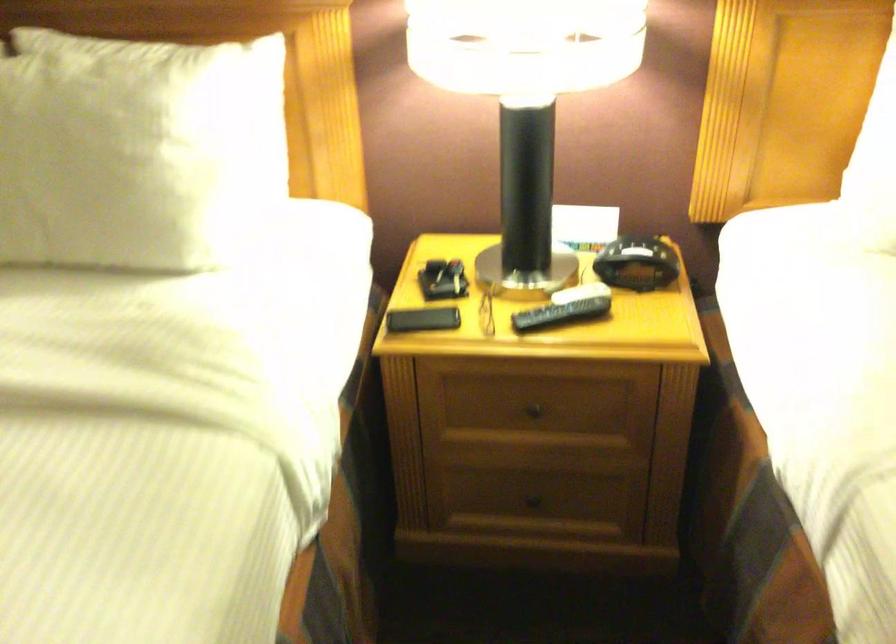
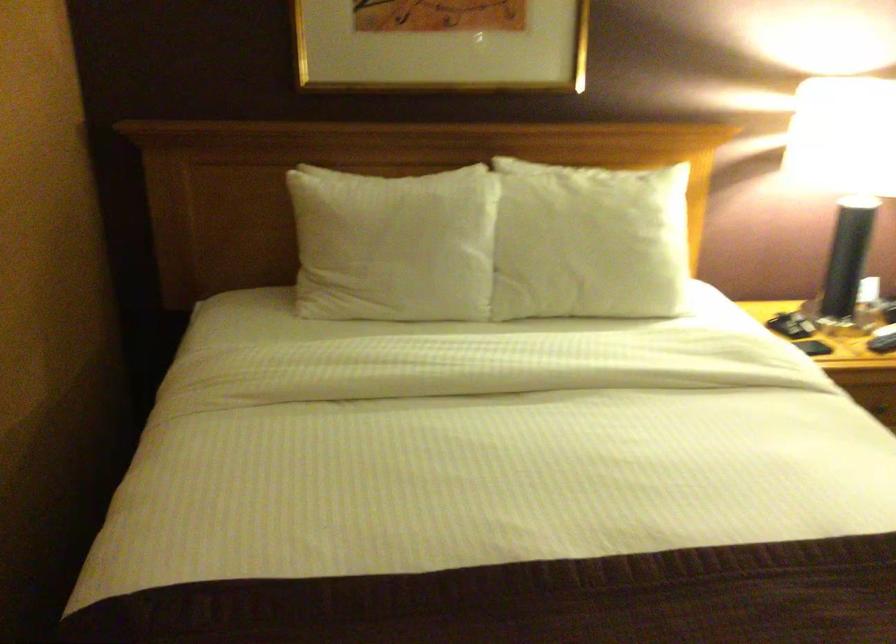
Find the pixel in the second image that matches (425,277) in the first image.

(782, 325)